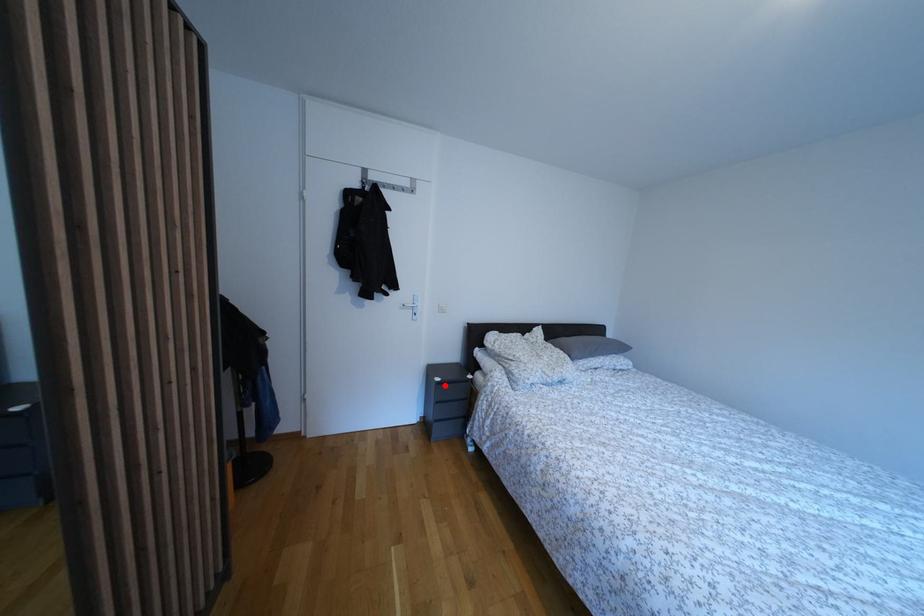
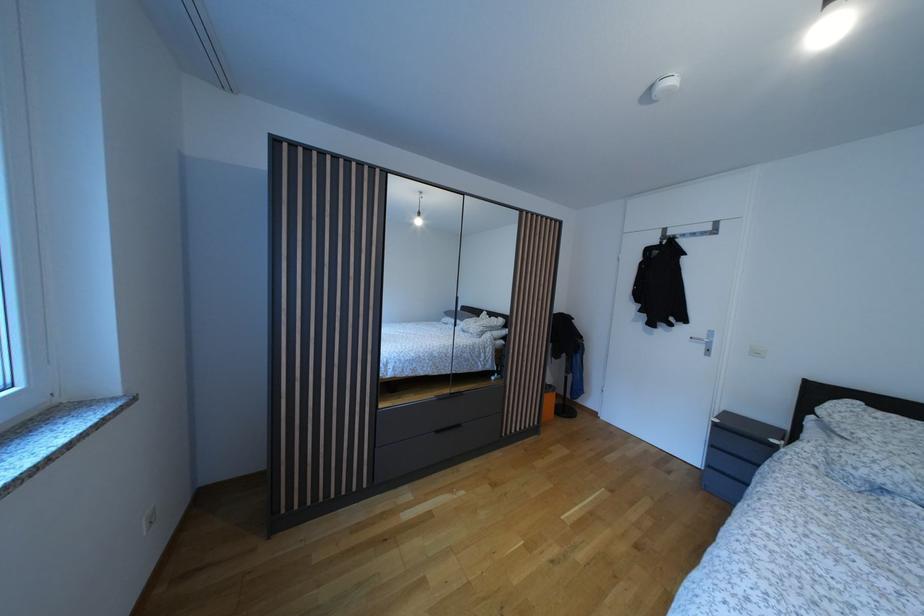
Where in the second image is the point corresponding to the highlighted location from the first image?

(723, 427)